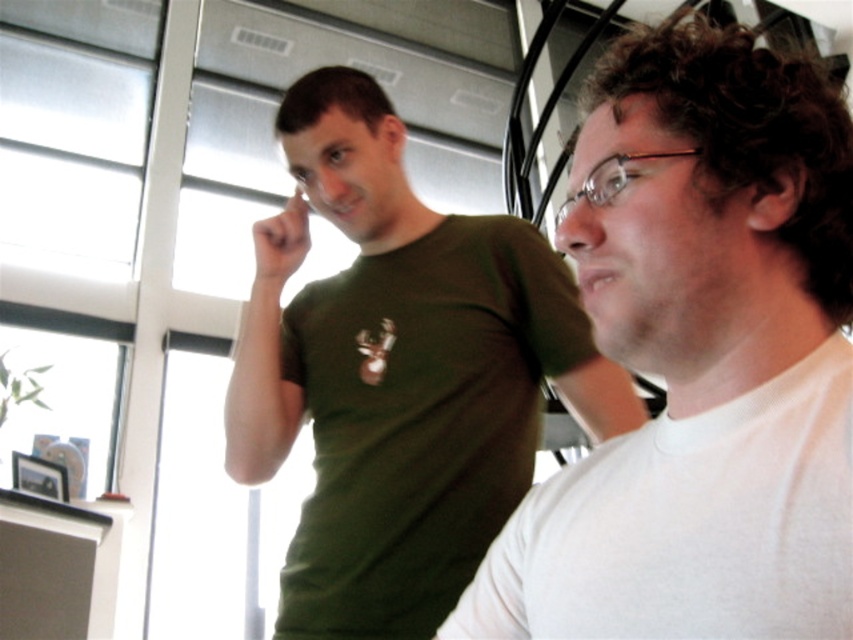
Based on the scene description, what are the coordinates of the white matte shirt at right?

The white matte shirt at right is located at coordinates point [700,358].